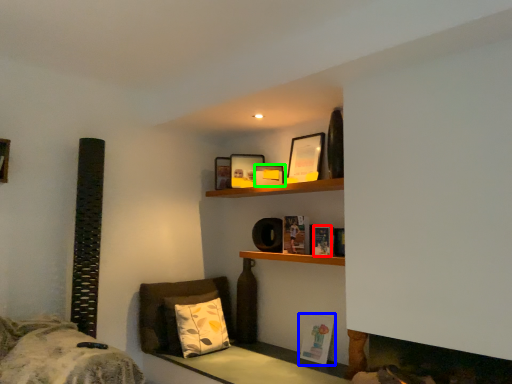
Question: Considering the real-world distances, which object is farthest from book (highlighted by a red box)? book (highlighted by a blue box) or picture frame (highlighted by a green box)?

Choices:
 (A) book
 (B) picture frame

Answer: (A)